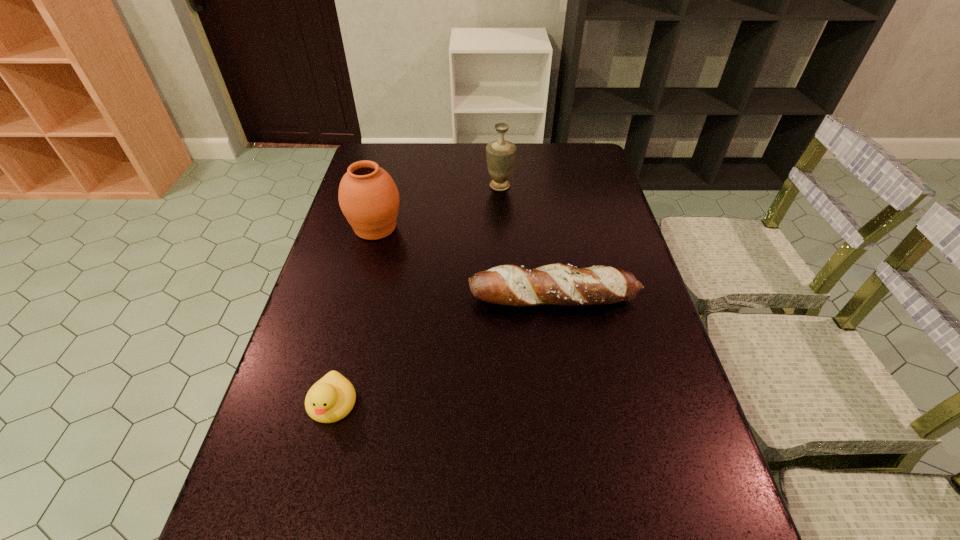
Identify the location of free space that satisfies the following two spatial constraints: 1. on the front side of the baguet; 2. on the right side of the left urn. (357, 297).

Where is `free space that satisfies the following two spatial constraints: 1. on the front side of the baguet; 2. on the left side of the farthest object`? free space that satisfies the following two spatial constraints: 1. on the front side of the baguet; 2. on the left side of the farthest object is located at coordinates (506, 297).